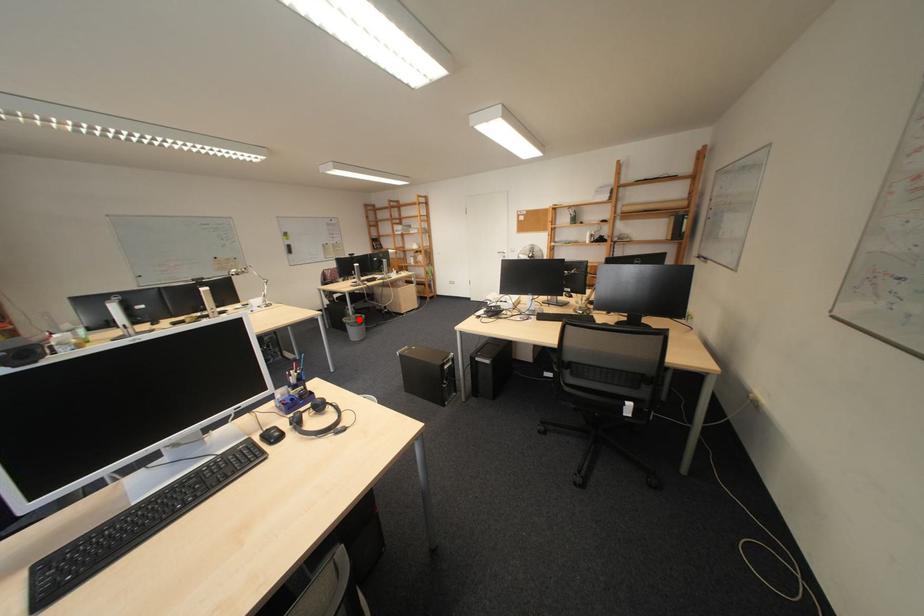
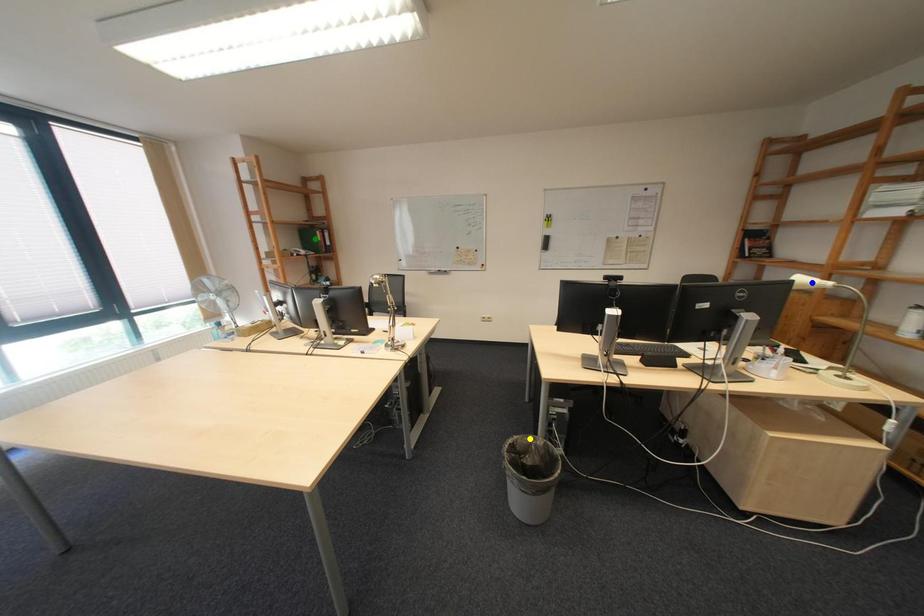
Question: I am providing you with two images of the same scene from different viewpoints. A red point is marked on the first image. You are given multiple points on the second image. In image 2, which mark is for the same physical point as the one in image 1?

Choices:
 (A) blue point
 (B) yellow point
 (C) green point

Answer: (B)